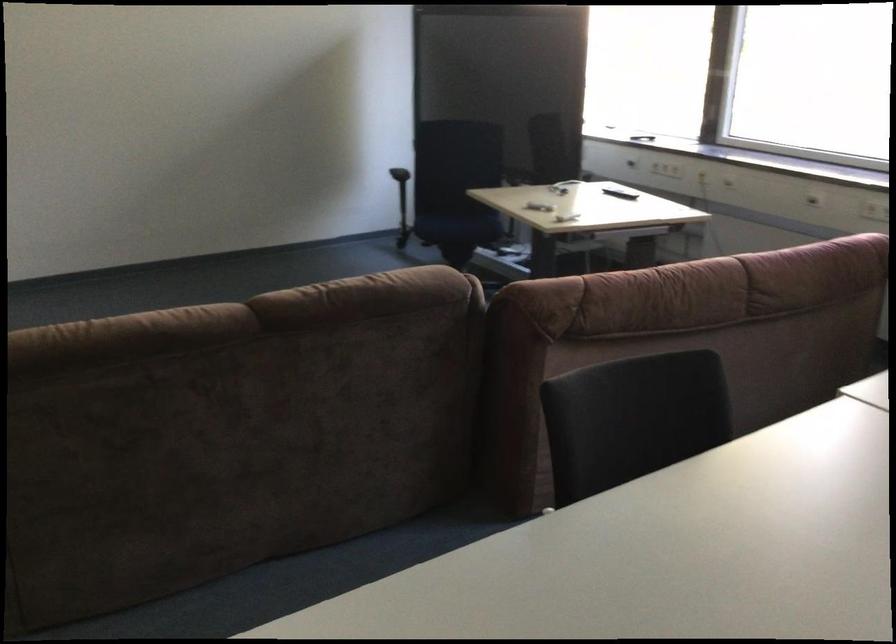
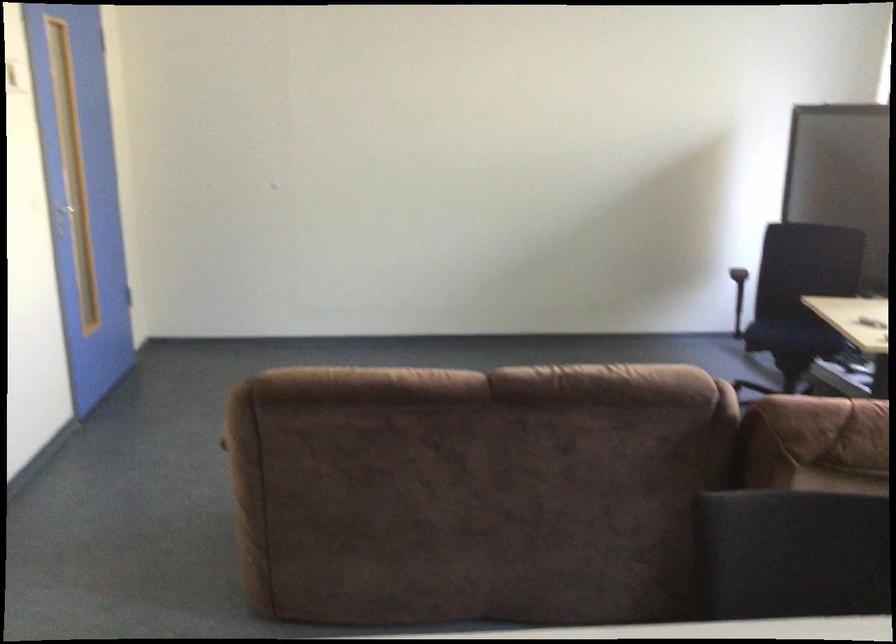
In the second image, find the point that corresponds to (x=254, y=319) in the first image.

(487, 386)